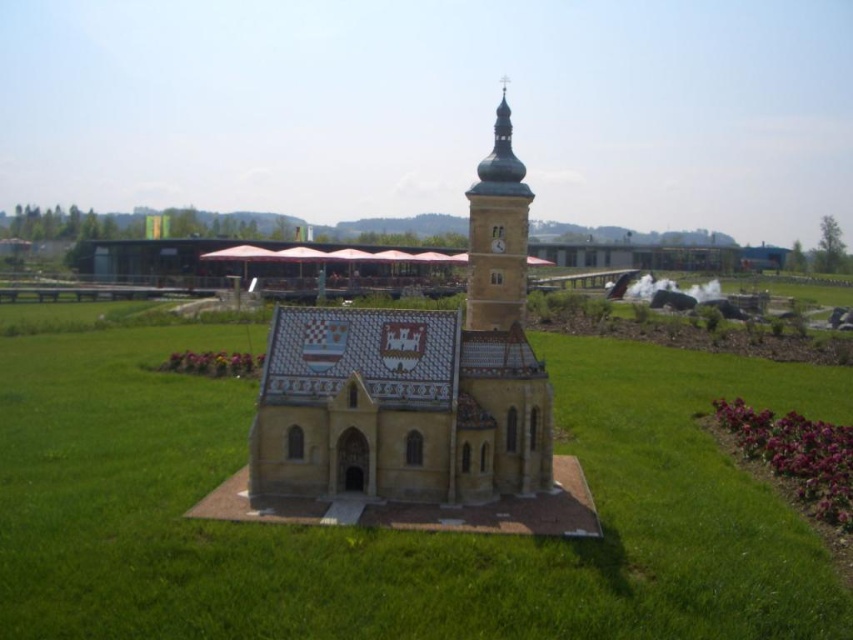
Question: Is checkered tile church at center bigger than multicolored mosaic church at center?

Choices:
 (A) no
 (B) yes

Answer: (B)

Question: Among these points, which one is nearest to the camera?

Choices:
 (A) pos(131,403)
 (B) pos(488,364)
 (C) pos(509,132)

Answer: (B)

Question: Which point appears farthest from the camera in this image?

Choices:
 (A) (491, 148)
 (B) (74, 333)
 (C) (360, 381)

Answer: (B)

Question: Does multicolored mosaic church at center have a larger size compared to brown stone clock tower at upper center?

Choices:
 (A) yes
 (B) no

Answer: (A)

Question: Is checkered tile church at center smaller than multicolored mosaic church at center?

Choices:
 (A) no
 (B) yes

Answer: (A)

Question: Which object is the closest to the brown stone clock tower at upper center?

Choices:
 (A) multicolored mosaic church at center
 (B) checkered tile church at center

Answer: (A)